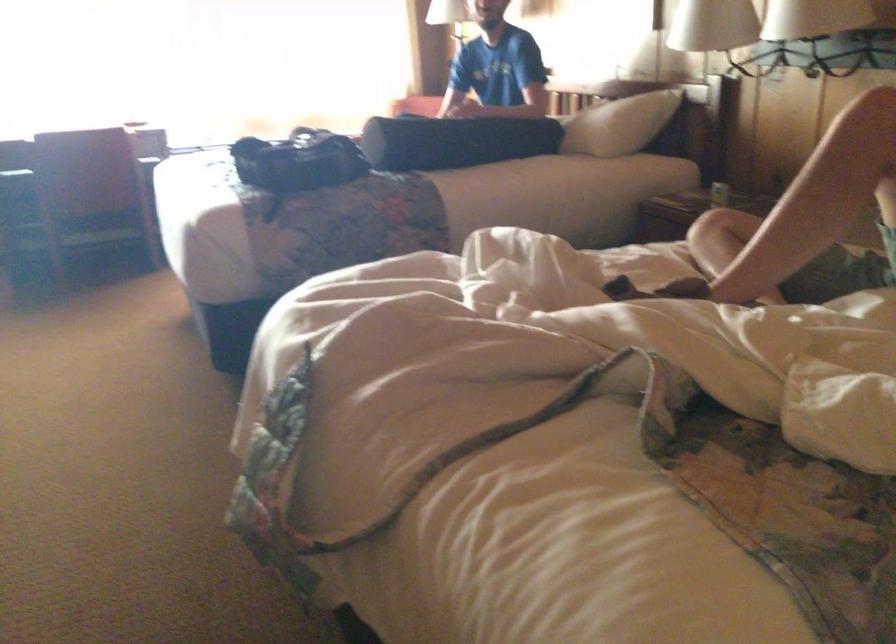
Which object does [297,161] point to?

It refers to a black bag.